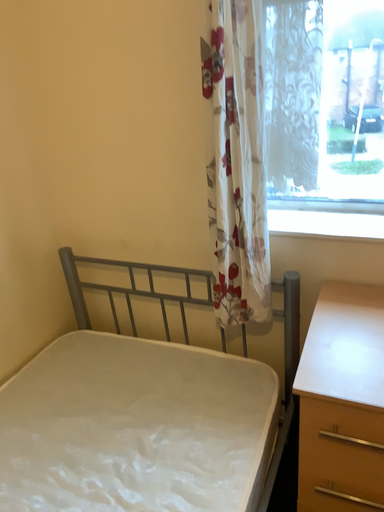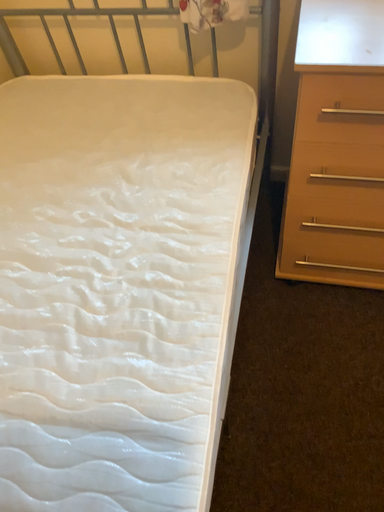
Question: Which way did the camera rotate in the video?

Choices:
 (A) rotated upward
 (B) rotated downward

Answer: (B)